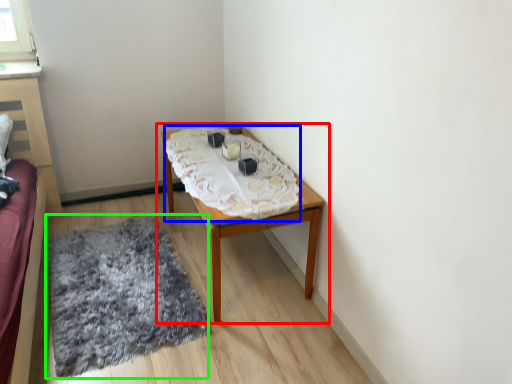
Question: Based on their relative distances, which object is farther from table (highlighted by a red box)? Choose from blanket (highlighted by a blue box) and mat (highlighted by a green box).

Choices:
 (A) blanket
 (B) mat

Answer: (B)